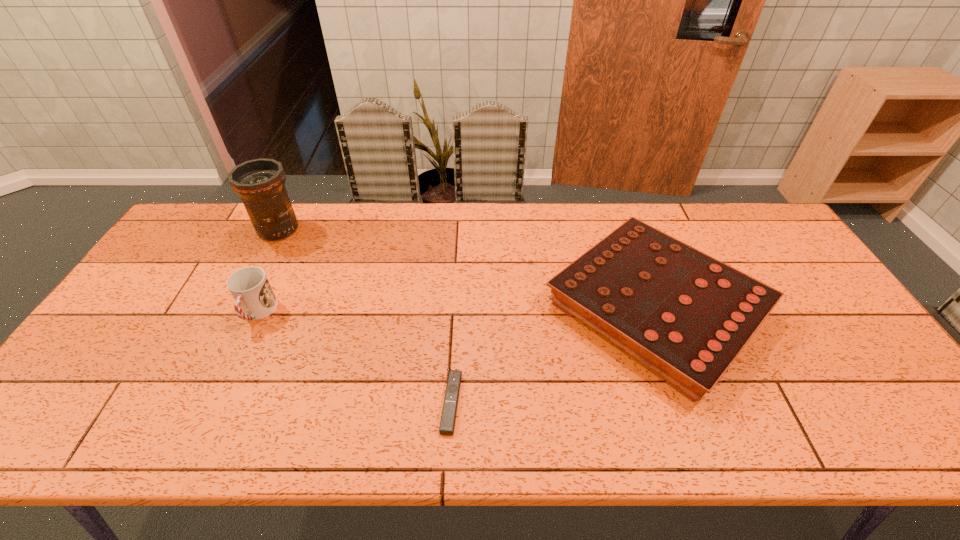
Identify the location of object identified as the second closest to the gameboard. (254, 298).

This screenshot has width=960, height=540. In order to click on vacant region that satisfies the following two spatial constraints: 1. on the front side of the tallest object; 2. on the left side of the gameboard in this screenshot , I will do `click(238, 308)`.

The image size is (960, 540). In order to click on vacant space that satisfies the following two spatial constraints: 1. on the side of the remote control where the handle is located; 2. on the right side of the third shortest object in this screenshot , I will do pyautogui.click(x=216, y=402).

Find the location of a particular element. The width and height of the screenshot is (960, 540). vacant area that satisfies the following two spatial constraints: 1. on the front side of the second object from right to left; 2. on the left side of the telephoto lens is located at coordinates (190, 402).